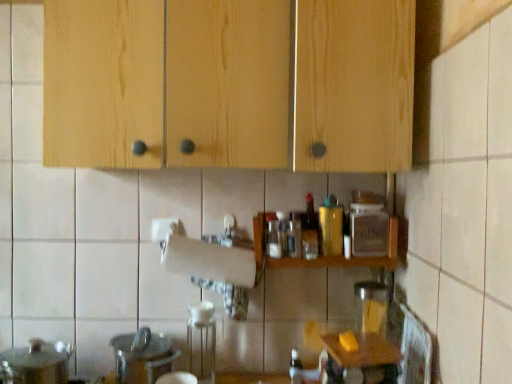
Question: From the image's perspective, is natural wood cabinets at upper center on wooden table at lower right?

Choices:
 (A) yes
 (B) no

Answer: (A)

Question: Is natural wood cabinets at upper center further to camera compared to wooden table at lower right?

Choices:
 (A) yes
 (B) no

Answer: (B)

Question: Is natural wood cabinets at upper center facing towards wooden table at lower right?

Choices:
 (A) yes
 (B) no

Answer: (B)

Question: Are natural wood cabinets at upper center and wooden table at lower right far apart?

Choices:
 (A) no
 (B) yes

Answer: (A)

Question: Can we say natural wood cabinets at upper center lies outside wooden table at lower right?

Choices:
 (A) yes
 (B) no

Answer: (A)

Question: Does natural wood cabinets at upper center have a greater width compared to wooden table at lower right?

Choices:
 (A) no
 (B) yes

Answer: (B)

Question: Is natural wood cabinets at upper center looking in the opposite direction of wooden spice rack at center?

Choices:
 (A) yes
 (B) no

Answer: (B)

Question: Would you say natural wood cabinets at upper center is outside wooden spice rack at center?

Choices:
 (A) yes
 (B) no

Answer: (A)

Question: From a real-world perspective, is natural wood cabinets at upper center physically below wooden spice rack at center?

Choices:
 (A) yes
 (B) no

Answer: (B)

Question: Would you say natural wood cabinets at upper center contains wooden spice rack at center?

Choices:
 (A) no
 (B) yes

Answer: (A)

Question: Is natural wood cabinets at upper center at the right side of wooden spice rack at center?

Choices:
 (A) yes
 (B) no

Answer: (B)

Question: From a real-world perspective, is natural wood cabinets at upper center positioned over wooden spice rack at center based on gravity?

Choices:
 (A) no
 (B) yes

Answer: (B)

Question: From the image's perspective, is translucent glass bottle at lower center, placed as the 3th bottle when sorted from top to bottom, on top of white matte paper towel at center?

Choices:
 (A) no
 (B) yes

Answer: (A)